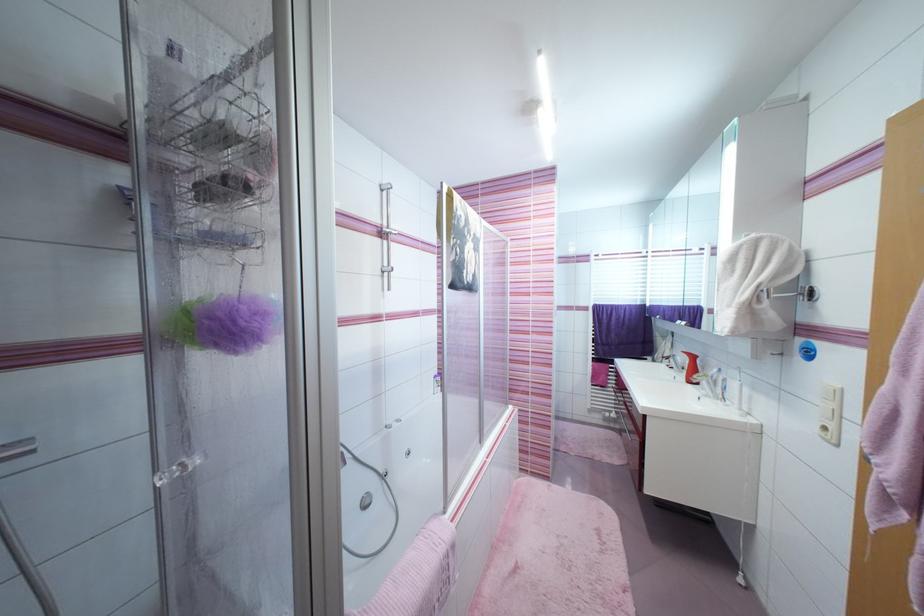
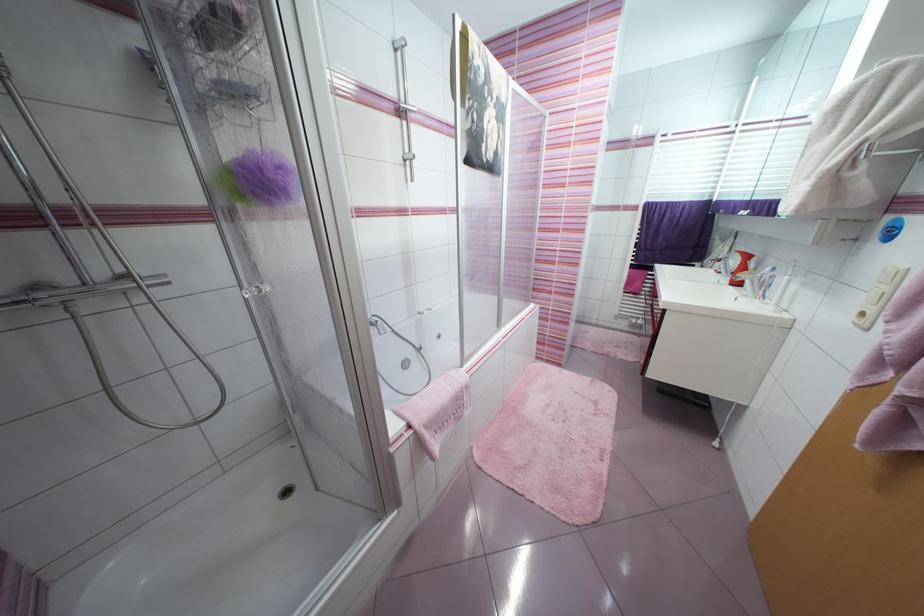
Question: How did the camera likely rotate?

Choices:
 (A) Left
 (B) Right
 (C) Up
 (D) Down

Answer: (D)